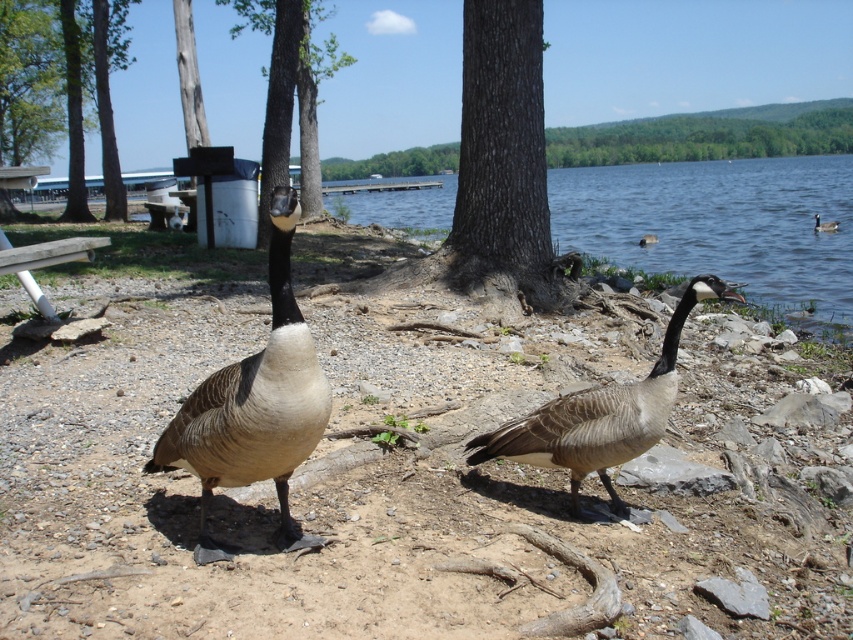
You are a photographer trying to capture the brown matte goose at center and the brown textured dirt at center in a single shot. Based on their positions, which object is closer to the camera?

The brown textured dirt at center is taller than the brown matte goose at center, so the brown textured dirt at center is closer to the camera.

Consider the image. You are a photographer setting up equipment near the lakeside. You have a tripod that needs to be placed between the brown textured dirt at center and the brushed metal trash can at upper left. According to the scene, where should you place the tripod?

The brown textured dirt at center is positioned on the right side of the brushed metal trash can at upper left, so you should place the tripod between them, ensuring it is to the right of the brushed metal trash can at upper left and to the left of the brown textured dirt at center.

From the picture: You are a photographer setting up a tripod to capture the Canada geese on the lakeside. You need to place the tripod on the brown textured dirt at center without blocking the view of the brushed metal trash can at upper left. Is the dirt area positioned in a way that allows this?

The brown textured dirt at center is below the brushed metal trash can at upper left, so placing the tripod there would keep the trash can visible in the upper part of the frame, allowing the geese to be the main focus while still including the trash can in the background.